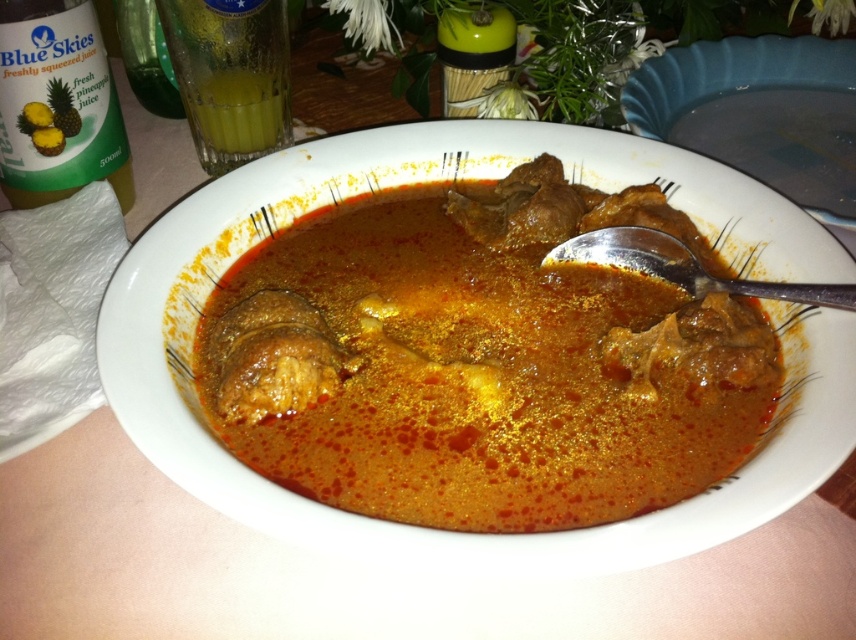
You are a diner who wants to serve yourself some curry. You see the silver metallic spoon at upper right and the translucent glass at upper left. Which utensil should you choose to scoop the curry?

The silver metallic spoon at upper right is larger than the translucent glass at upper left, so you should choose the silver metallic spoon at upper right to scoop the curry.

You are at a dinner table and want to reach for both the green glass bottle at upper left and the silver metallic spoon at upper right. Considering their positions, which one is closer to your current hand position?

The green glass bottle at upper left is 19.28 inches away from the silver metallic spoon at upper right. Without knowing your exact hand position, it is impossible to determine which is closer. Please provide more information about where your hand is located relative to the objects.